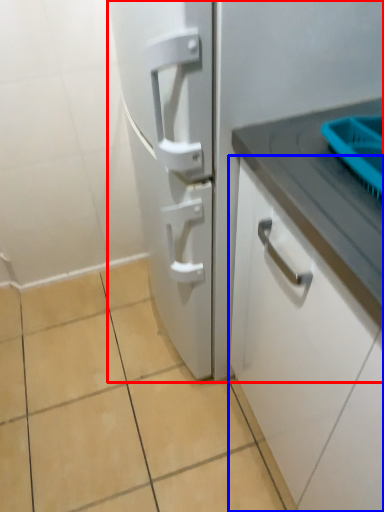
Question: Which of the following is the farthest to the observer, refrigerator (highlighted by a red box) or cabinetry (highlighted by a blue box)?

Choices:
 (A) refrigerator
 (B) cabinetry

Answer: (A)